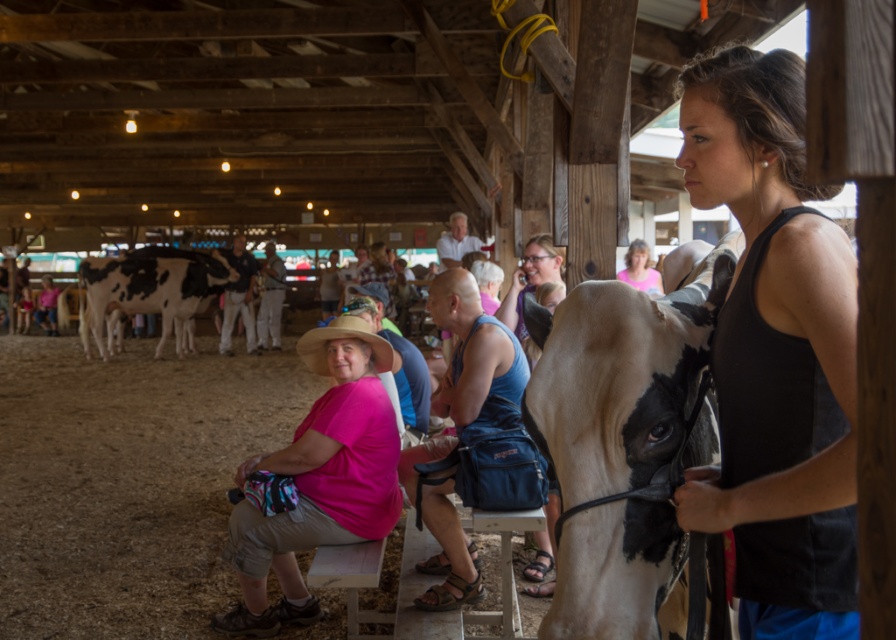
Question: Which object is farther from the camera taking this photo?

Choices:
 (A) white and black spotted cow at left
 (B) white glossy cow at center

Answer: (A)

Question: From the image, what is the correct spatial relationship of pink fabric shirt at center in relation to pink matte shirt at center?

Choices:
 (A) above
 (B) below

Answer: (B)

Question: Estimate the real-world distances between objects in this image. Which object is farther from the pink matte shirt at center?

Choices:
 (A) black matte tank top at center
 (B) white glossy cow at center
 (C) white and black spotted cow at left
 (D) pink fabric shirt at center

Answer: (C)

Question: Is black matte tank top at center to the left of pink matte shirt at center from the viewer's perspective?

Choices:
 (A) yes
 (B) no

Answer: (A)

Question: Which object appears farthest from the camera in this image?

Choices:
 (A) pink matte shirt at center
 (B) white and black spotted cow at left

Answer: (B)

Question: Does black matte tank top at center appear under white and black spotted cow at left?

Choices:
 (A) yes
 (B) no

Answer: (A)